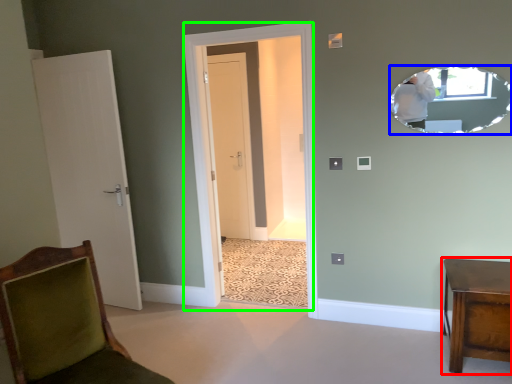
Question: Which is farther away from furniture (highlighted by a red box)? mirror (highlighted by a blue box) or glass door (highlighted by a green box)?

Choices:
 (A) mirror
 (B) glass door

Answer: (B)